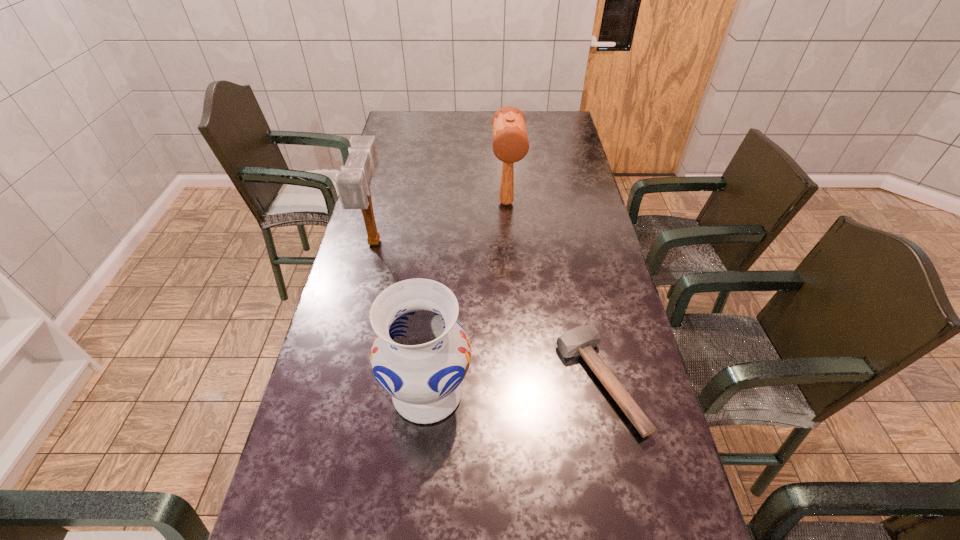
Image resolution: width=960 pixels, height=540 pixels. What are the coordinates of `free space between the rightmost object and the second object from left to right` in the screenshot? It's located at (514, 387).

Find the location of a particular element. This screenshot has height=540, width=960. vacant area that lies between the third object from left to right and the nearest mallet is located at coordinates (553, 293).

Select which object appears as the third closest to the leftmost mallet. Please provide its 2D coordinates. Your answer should be formatted as a tuple, i.e. [(x, y)], where the tuple contains the x and y coordinates of a point satisfying the conditions above.

[(581, 340)]

You are a GUI agent. You are given a task and a screenshot of the screen. Output one action in this format:
    pyautogui.click(x=<x>, y=<y>)
    Task: Click on the object that is the second closest one to the second object from left to right
    The image size is (960, 540).
    Given the screenshot: What is the action you would take?
    pyautogui.click(x=353, y=183)

Select which mallet is the second closest to the third object from left to right. Please provide its 2D coordinates. Your answer should be formatted as a tuple, i.e. [(x, y)], where the tuple contains the x and y coordinates of a point satisfying the conditions above.

[(581, 340)]

Locate an element on the screen. The height and width of the screenshot is (540, 960). mallet object that ranks as the closest to the second mallet from left to right is located at coordinates (353, 183).

Locate an element on the screen. The width and height of the screenshot is (960, 540). free space that satisfies the following two spatial constraints: 1. on the strike surface of the rightmost object; 2. on the right side of the second mallet from left to right is located at coordinates (518, 382).

Locate an element on the screen. free spot that satisfies the following two spatial constraints: 1. on the front side of the second object from left to right; 2. on the left side of the leftmost object is located at coordinates (337, 393).